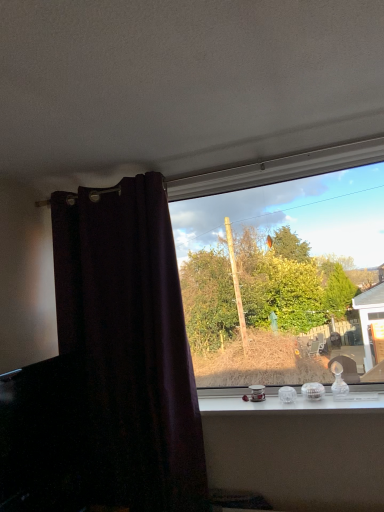
Question: Considering the relative sizes of clear glass ornaments at center and dark purple velvet curtain at left in the image provided, is clear glass ornaments at center bigger than dark purple velvet curtain at left?

Choices:
 (A) no
 (B) yes

Answer: (A)

Question: Is clear glass ornaments at center facing away from dark purple velvet curtain at left?

Choices:
 (A) yes
 (B) no

Answer: (B)

Question: From a real-world perspective, is clear glass ornaments at center positioned over dark purple velvet curtain at left based on gravity?

Choices:
 (A) no
 (B) yes

Answer: (A)

Question: Considering the relative sizes of clear glass ornaments at center and dark purple velvet curtain at left in the image provided, is clear glass ornaments at center shorter than dark purple velvet curtain at left?

Choices:
 (A) no
 (B) yes

Answer: (B)

Question: Is clear glass ornaments at center outside of dark purple velvet curtain at left?

Choices:
 (A) yes
 (B) no

Answer: (A)

Question: Can you confirm if clear glass ornaments at center is smaller than dark purple velvet curtain at left?

Choices:
 (A) yes
 (B) no

Answer: (A)

Question: From the image's perspective, is dark purple velvet curtain at left below clear glass ornaments at center?

Choices:
 (A) yes
 (B) no

Answer: (B)

Question: Is dark purple velvet curtain at left outside of clear glass ornaments at center?

Choices:
 (A) no
 (B) yes

Answer: (B)

Question: From the image's perspective, does dark purple velvet curtain at left appear higher than clear glass ornaments at center?

Choices:
 (A) no
 (B) yes

Answer: (B)

Question: From a real-world perspective, is dark purple velvet curtain at left located higher than clear glass ornaments at center?

Choices:
 (A) no
 (B) yes

Answer: (B)

Question: Can you confirm if dark purple velvet curtain at left is shorter than clear glass ornaments at center?

Choices:
 (A) no
 (B) yes

Answer: (A)

Question: Can you confirm if dark purple velvet curtain at left is taller than clear glass ornaments at center?

Choices:
 (A) yes
 (B) no

Answer: (A)

Question: Is dark purple velvet curtain at left thinner than transparent glass window at center?

Choices:
 (A) no
 (B) yes

Answer: (A)